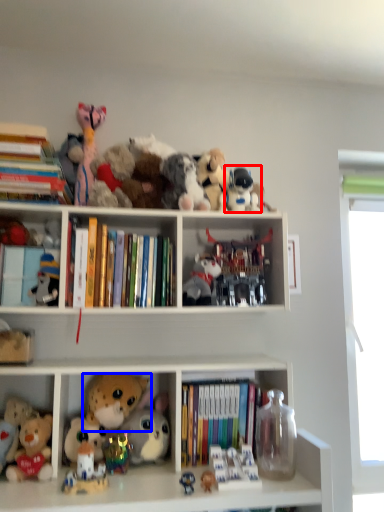
Question: Which of the following is the farthest to the observer, toy (highlighted by a red box) or toy (highlighted by a blue box)?

Choices:
 (A) toy
 (B) toy

Answer: (A)